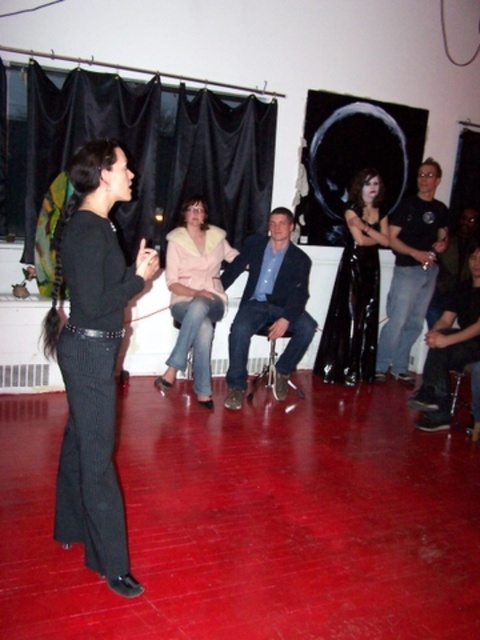
You are organizing a small event in this room and need to place a 1.2 meter wide table between the pink fuzzy coat at center and the black leather pants at lower right. Is there enough space?

The pink fuzzy coat at center might be wider than black leather pants at lower right, so the space between them may not be sufficient for a 1.2 meter wide table. Check the actual dimensions before placing the table.

You are standing in the room and want to hand a document to the person wearing the blue denim jeans at center and the person wearing the black leather pants at lower right. Which direction should you walk to reach the higher positioned individual first?

The blue denim jeans at center is located above black leather pants at lower right, so you should walk towards the blue denim jeans at center first to reach the higher positioned individual.

You are standing at the entrance of the room and want to locate the pink fuzzy coat at center. According to the coordinates provided, where would you find it?

The pink fuzzy coat at center is located at coordinates point (194, 294).